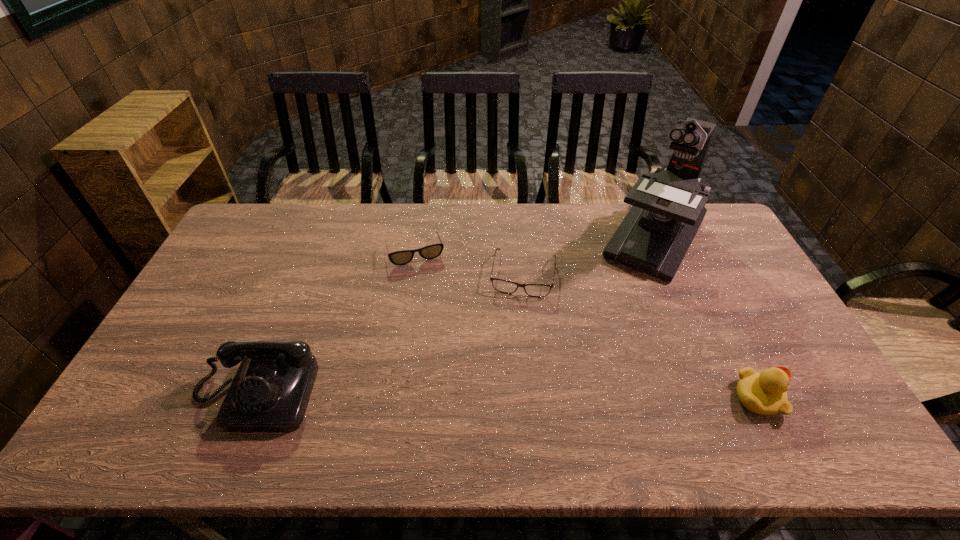
Where is `object at the left edge`? This screenshot has height=540, width=960. object at the left edge is located at coordinates click(270, 391).

In order to click on duckling located in the right edge section of the desktop in this screenshot , I will do `click(764, 393)`.

Locate an element on the screen. microscope that is at the right edge is located at coordinates (668, 208).

Identify the location of object located in the near left corner section of the desktop. (270, 391).

The width and height of the screenshot is (960, 540). I want to click on object that is at the far right corner, so click(668, 208).

This screenshot has height=540, width=960. Find the location of `object that is at the near right corner`. object that is at the near right corner is located at coordinates (764, 393).

Find the location of a particular element. blank space at the far edge is located at coordinates pyautogui.click(x=308, y=207).

Where is `vacant space at the near edge of the desktop`? The image size is (960, 540). vacant space at the near edge of the desktop is located at coordinates (601, 400).

Image resolution: width=960 pixels, height=540 pixels. What are the coordinates of `vacant area at the left edge of the desktop` in the screenshot? It's located at (247, 278).

In the image, there is a desktop. Identify the location of vacant space at the right edge. This screenshot has width=960, height=540. (700, 247).